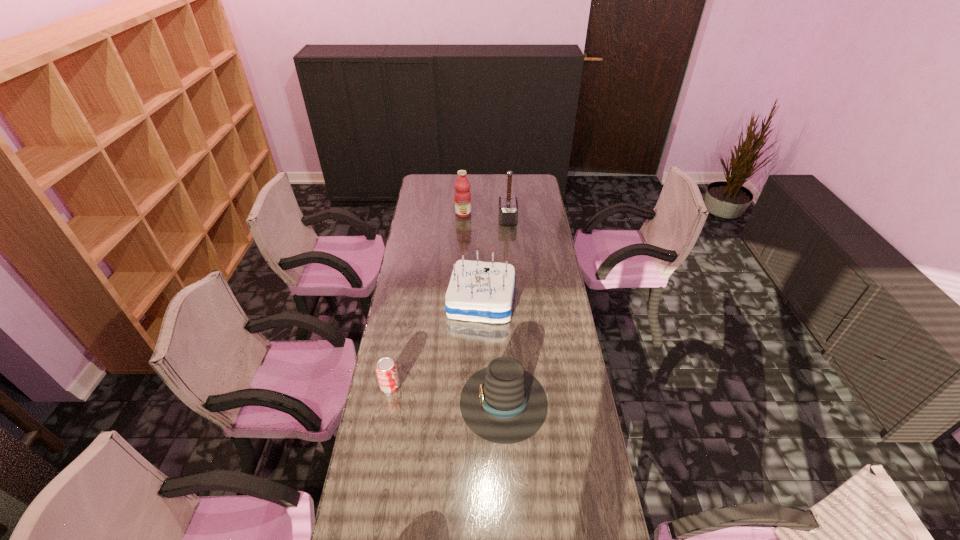
Image resolution: width=960 pixels, height=540 pixels. I want to click on vacant space that is in between the fruit juice and the third nearest object, so click(x=472, y=258).

This screenshot has width=960, height=540. Find the location of `vacant space in between the second shortest object and the third farthest object`. vacant space in between the second shortest object and the third farthest object is located at coordinates (492, 352).

Where is `the closest object relative to the hat`? Image resolution: width=960 pixels, height=540 pixels. the closest object relative to the hat is located at coordinates (478, 291).

The height and width of the screenshot is (540, 960). I want to click on the closest object to the hammer, so click(462, 194).

Locate an element on the screen. The width and height of the screenshot is (960, 540). vacant space that satisfies the following two spatial constraints: 1. on the label of the hammer; 2. on the right side of the fruit juice is located at coordinates (463, 219).

Image resolution: width=960 pixels, height=540 pixels. Find the location of `free space that satisfies the following two spatial constraints: 1. on the back side of the soda can; 2. on the left side of the hammer`. free space that satisfies the following two spatial constraints: 1. on the back side of the soda can; 2. on the left side of the hammer is located at coordinates (420, 219).

You are a GUI agent. You are given a task and a screenshot of the screen. Output one action in this format:
    pyautogui.click(x=<x>, y=<y>)
    Task: Click on the vacant space that satisfies the following two spatial constraints: 1. on the label of the fruit juice; 2. on the left side of the third nearest object
    The width and height of the screenshot is (960, 540).
    Given the screenshot: What is the action you would take?
    pyautogui.click(x=459, y=301)